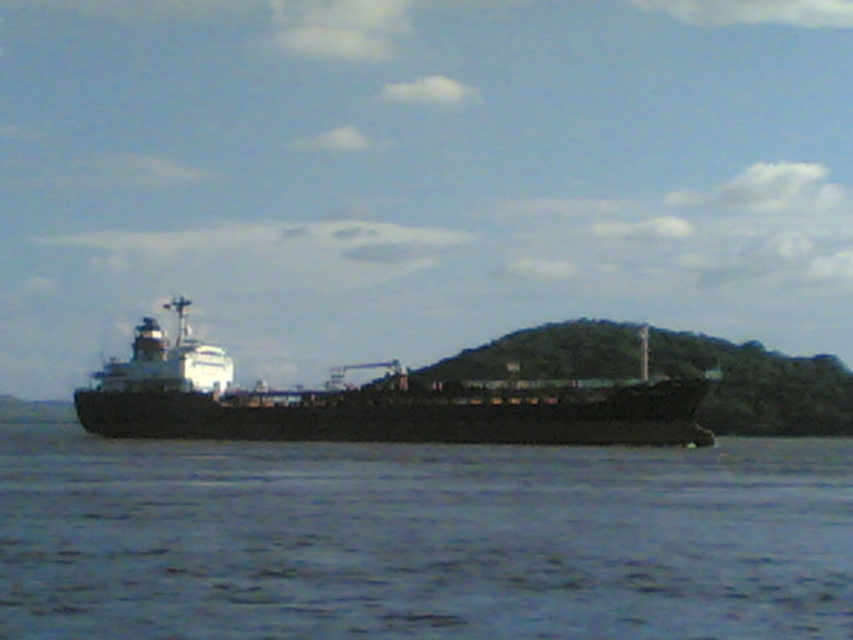
Question: From the image, what is the correct spatial relationship of blue water at lower center in relation to black matte ship at center?

Choices:
 (A) below
 (B) above

Answer: (A)

Question: Which of the following is the farthest from the observer?

Choices:
 (A) (93, 422)
 (B) (291, 595)

Answer: (A)

Question: Does blue water at lower center have a greater width compared to black matte ship at center?

Choices:
 (A) no
 (B) yes

Answer: (B)

Question: Does blue water at lower center appear on the left side of black matte ship at center?

Choices:
 (A) yes
 (B) no

Answer: (B)

Question: Which object is closer to the camera taking this photo?

Choices:
 (A) blue water at lower center
 (B) black matte ship at center

Answer: (A)

Question: Among these objects, which one is farthest from the camera?

Choices:
 (A) blue water at lower center
 (B) black matte ship at center

Answer: (B)